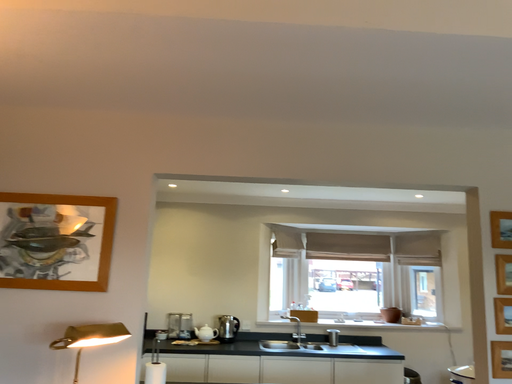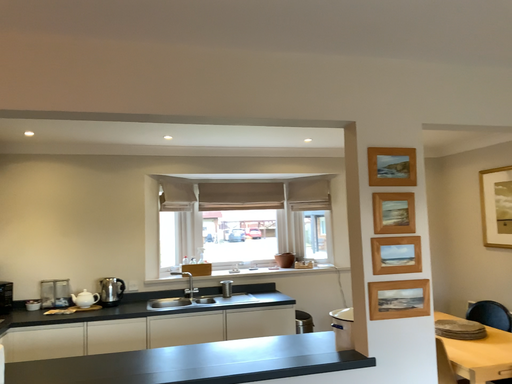
Question: Which way did the camera rotate in the video?

Choices:
 (A) rotated left
 (B) rotated right

Answer: (B)